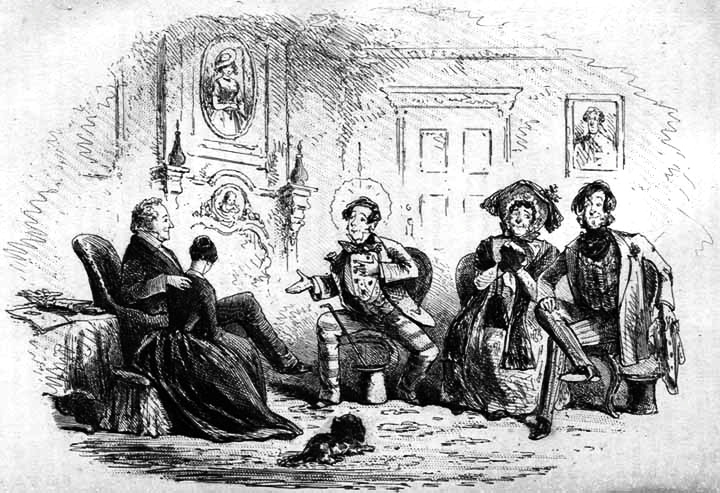
Locate an element on the screen. door frame is located at coordinates click(x=409, y=100), click(x=499, y=100), click(x=505, y=141), click(x=396, y=146).